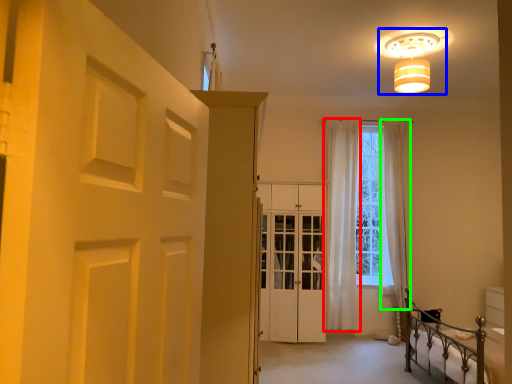
Question: Considering the real-world distances, which object is farthest from curtain (highlighted by a red box)? lamp (highlighted by a blue box) or curtain (highlighted by a green box)?

Choices:
 (A) lamp
 (B) curtain

Answer: (A)